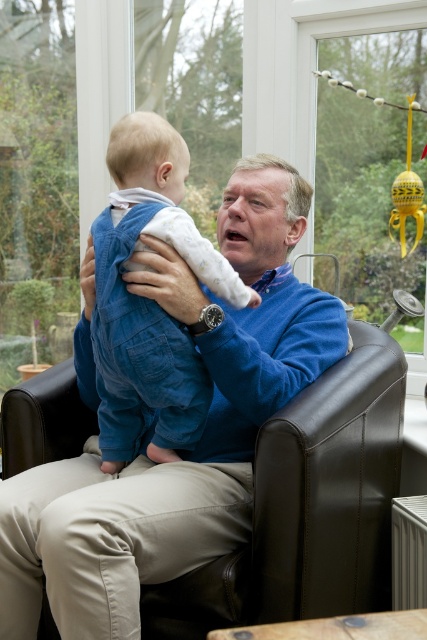
Which of these two, blue sweater at center or denim overalls at center, stands shorter?

denim overalls at center is shorter.

You are a GUI agent. You are given a task and a screenshot of the screen. Output one action in this format:
    pyautogui.click(x=<x>, y=<y>)
    Task: Click on the blue sweater at center
    The image size is (427, 640).
    Given the screenshot: What is the action you would take?
    pyautogui.click(x=198, y=442)

Image resolution: width=427 pixels, height=640 pixels. Identify the location of blue sweater at center. pyautogui.click(x=198, y=442).